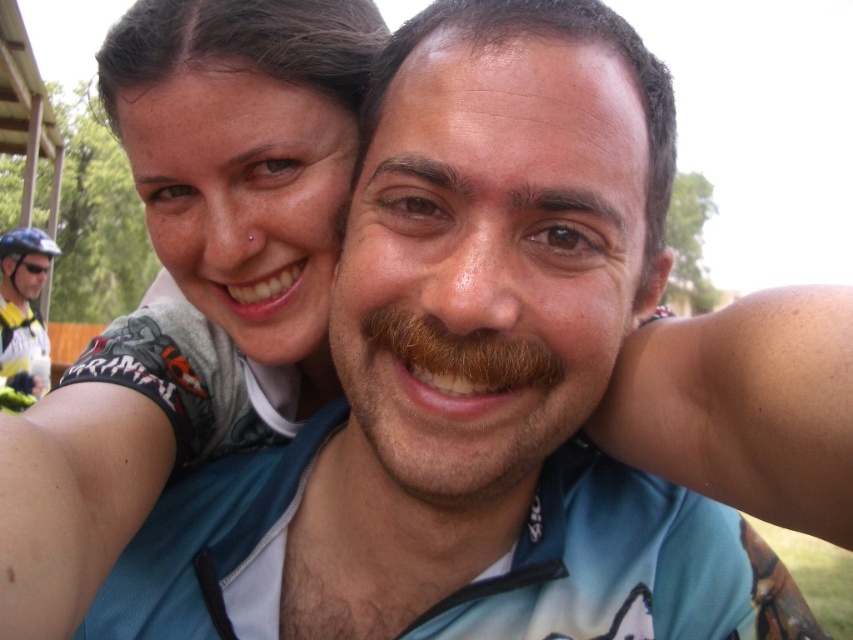
You are a photographer adjusting your camera to focus on the two people in the image. There is a specific point at coordinates point (193, 280) that you need to consider. What is located at this point?

The point at (193, 280) has matte skin at center.

Looking at the selfie, you notice two facial features at the center of the image. One is the matte skin at center and the other is the brown fuzzy mustache at center. Which of these two features takes up more space in the photo?

The matte skin at center is bigger than the brown fuzzy mustache at center, so it occupies more space in the photo.